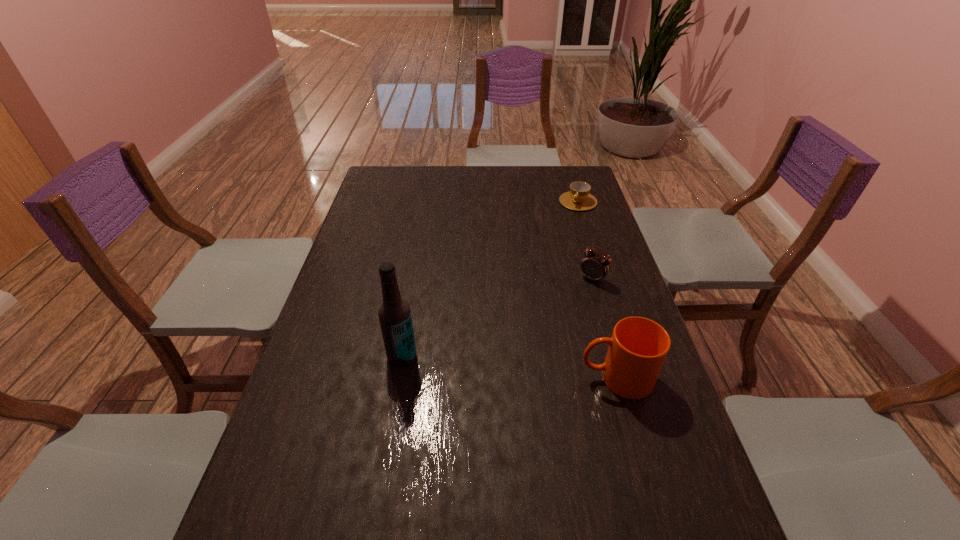
Locate an element on the screen. This screenshot has height=540, width=960. free location located 0.240m on the handle side of the second tallest object is located at coordinates (482, 378).

At what (x,y) coordinates should I click in order to perform the action: click on vacant space located on the face of the third tallest object. Please return your answer as a coordinate pair (x, y). Looking at the image, I should click on (561, 313).

Locate an element on the screen. free space located 0.110m on the face of the third tallest object is located at coordinates (567, 305).

I want to click on free point located 0.130m on the face of the third tallest object, so click(564, 309).

Where is `free space located 0.210m with the handle on the side of the shortest object`? The height and width of the screenshot is (540, 960). free space located 0.210m with the handle on the side of the shortest object is located at coordinates (555, 241).

Where is `free space located 0.200m with the handle on the side of the shortest object`? free space located 0.200m with the handle on the side of the shortest object is located at coordinates [556, 239].

Find the location of a particular element. vacant area located with the handle on the side of the shortest object is located at coordinates (544, 259).

Locate an element on the screen. This screenshot has height=540, width=960. object that is at the far edge is located at coordinates (578, 198).

Identify the location of mug located in the right edge section of the desktop. This screenshot has height=540, width=960. (x=638, y=347).

Find the location of `alarm clock that is at the right edge`. alarm clock that is at the right edge is located at coordinates (595, 266).